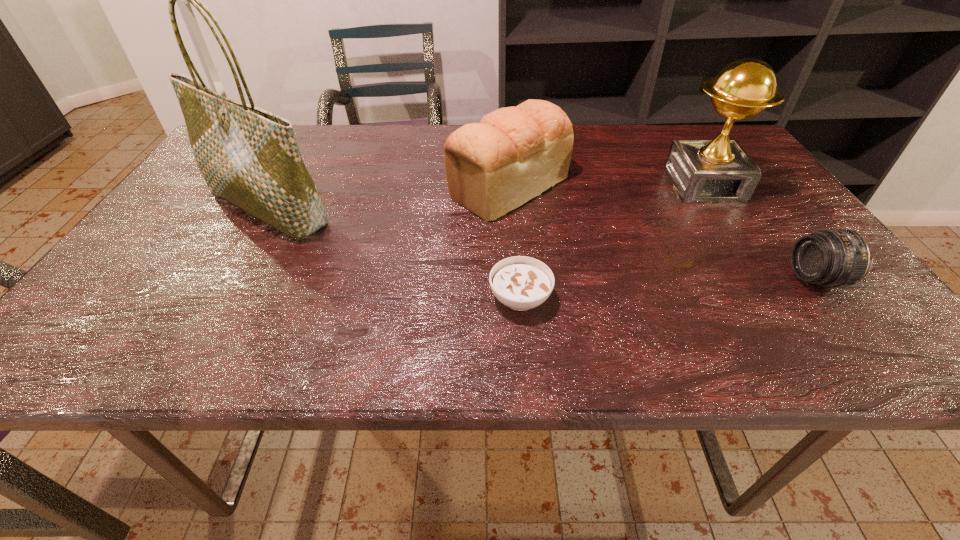
Where is `vacant space situated 0.170m at the front element of the telephoto lens`? This screenshot has width=960, height=540. vacant space situated 0.170m at the front element of the telephoto lens is located at coordinates (707, 279).

Locate an element on the screen. This screenshot has width=960, height=540. free space located at the front element of the telephoto lens is located at coordinates (717, 279).

The width and height of the screenshot is (960, 540). I want to click on free space located on the right of the soup bowl, so [700, 298].

The height and width of the screenshot is (540, 960). Identify the location of object that is at the far edge. coord(513,154).

Identify the location of object present at the near edge. The width and height of the screenshot is (960, 540). (521, 283).

Image resolution: width=960 pixels, height=540 pixels. What are the coordinates of `object present at the left edge` in the screenshot? It's located at (249, 157).

Find the location of `award that is at the right edge`. award that is at the right edge is located at coordinates (718, 170).

The width and height of the screenshot is (960, 540). I want to click on telephoto lens present at the right edge, so click(837, 257).

This screenshot has width=960, height=540. In the image, there is a desktop. Find the location of `vacant space at the far edge`. vacant space at the far edge is located at coordinates (308, 161).

I want to click on free space at the near edge of the desktop, so 615,362.